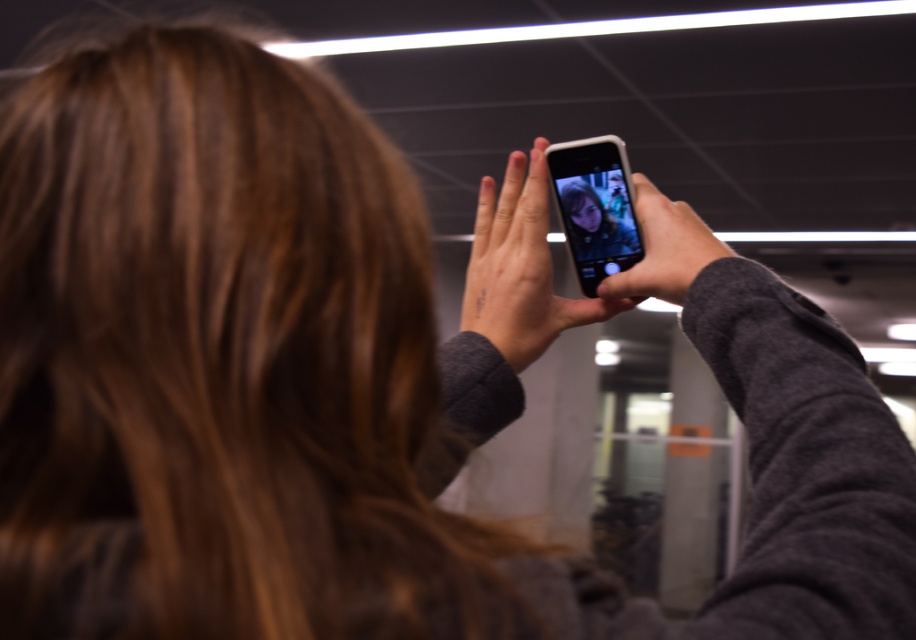
Question: Among these objects, which one is farthest from the camera?

Choices:
 (A) satin black phone at upper center
 (B) matte black phone at upper center

Answer: (A)

Question: In this image, where is satin black phone at upper center located relative to matte black phone at upper center?

Choices:
 (A) left
 (B) right

Answer: (A)

Question: Where is satin black phone at upper center located in relation to matte black phone at upper center in the image?

Choices:
 (A) above
 (B) below

Answer: (A)

Question: Is satin black phone at upper center bigger than matte black phone at upper center?

Choices:
 (A) yes
 (B) no

Answer: (A)